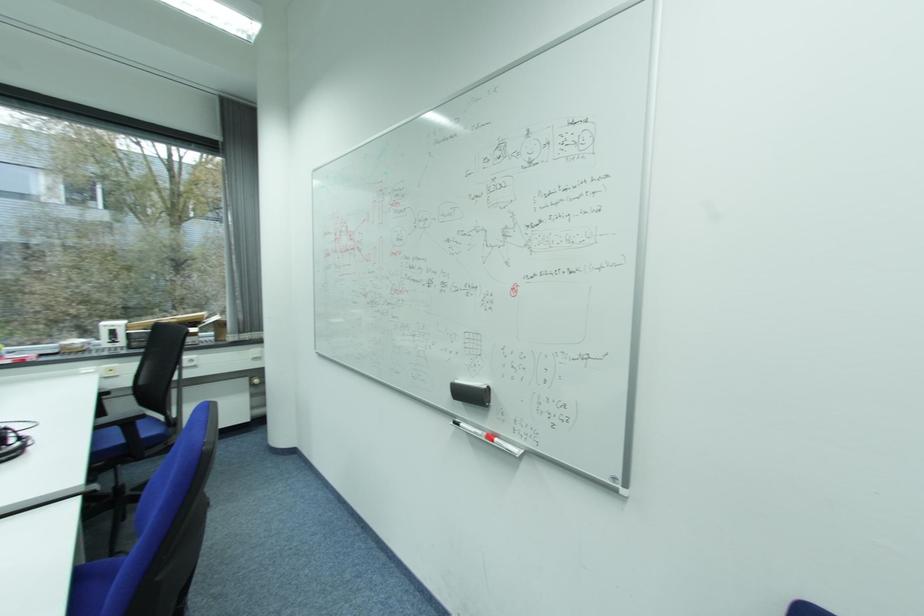
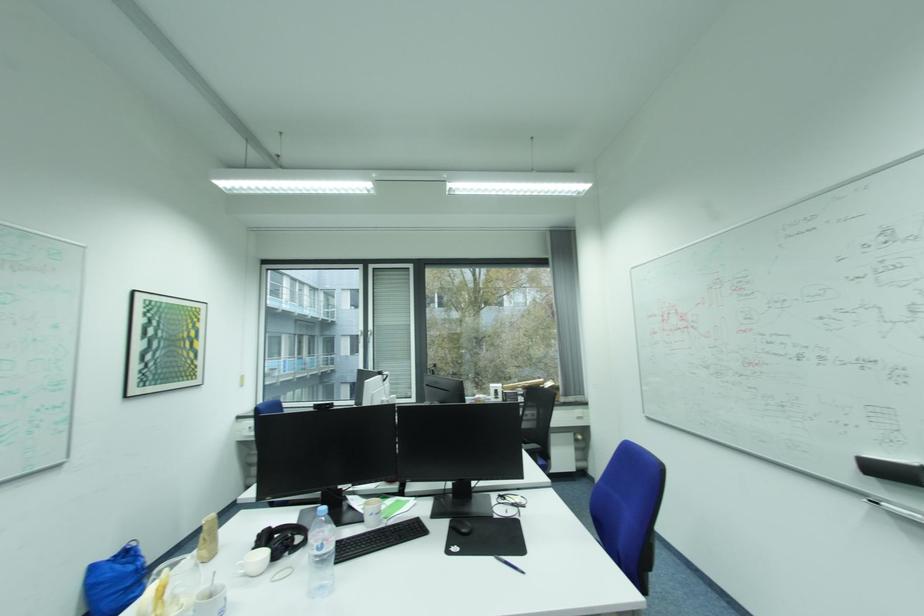
Question: I am providing you with two images of the same scene from different viewpoints. Please identify which objects are invisible in image2.

Choices:
 (A) plastic water bottle
 (B) black headphones
 (C) book spine
 (D) black whiteboard eraser

Answer: (B)